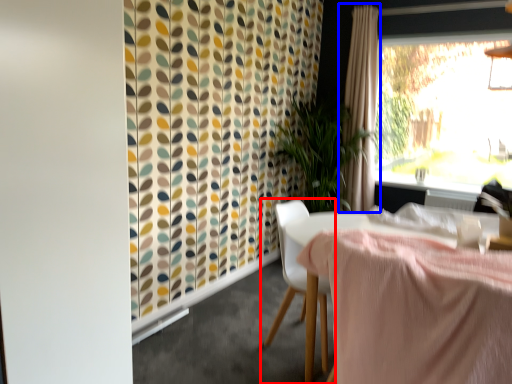
Question: Which object is further to the camera taking this photo, chair (highlighted by a red box) or curtain (highlighted by a blue box)?

Choices:
 (A) chair
 (B) curtain

Answer: (B)